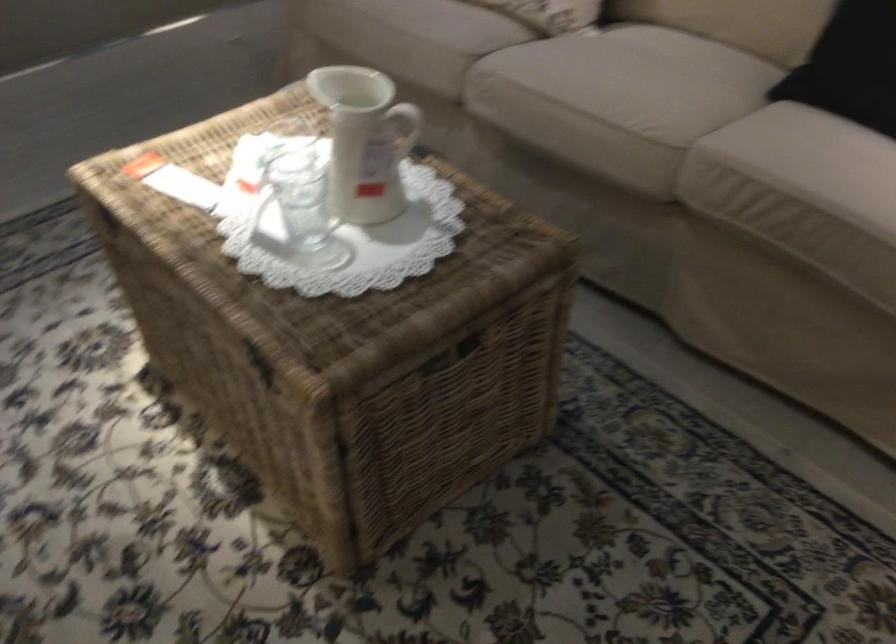
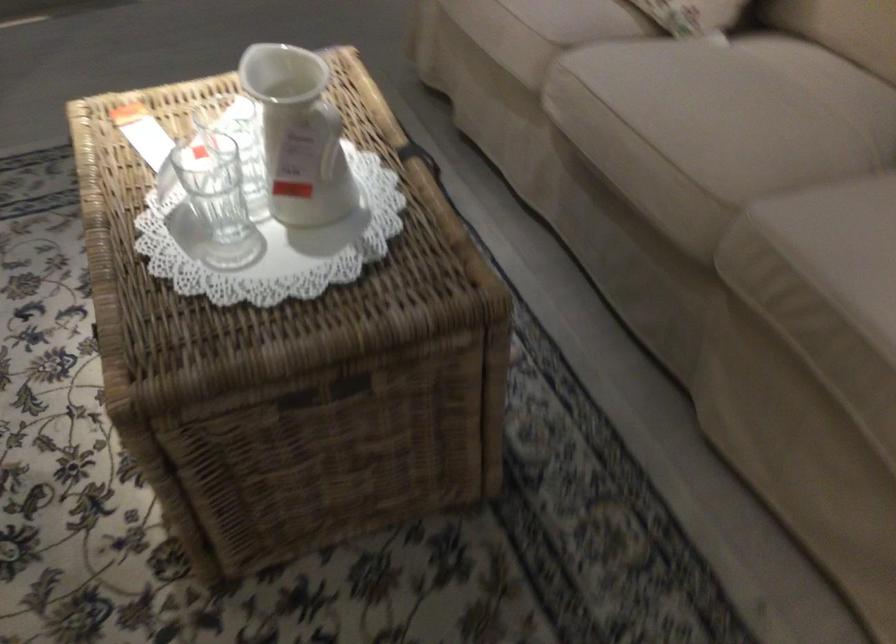
Where in the second image is the point corresponding to point (390, 138) from the first image?

(328, 137)